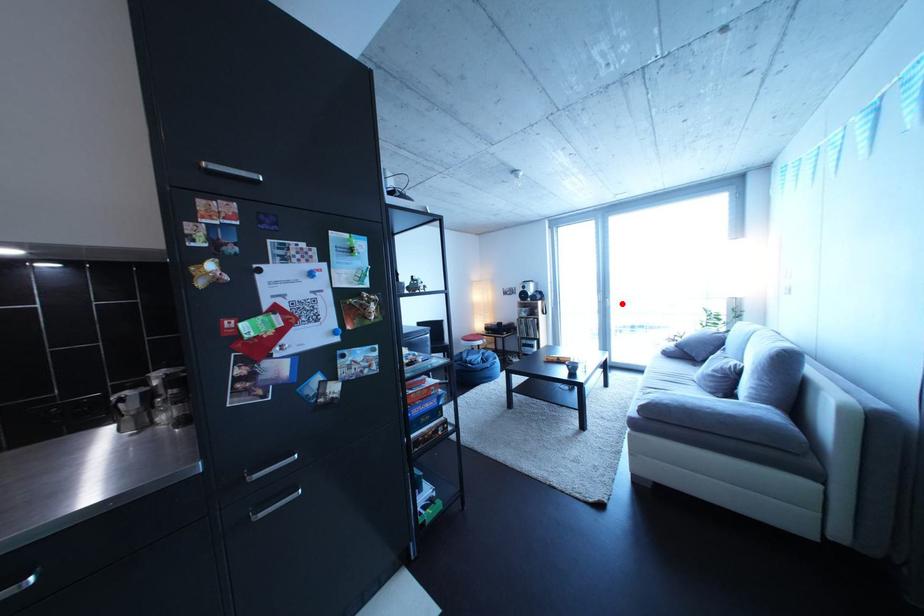
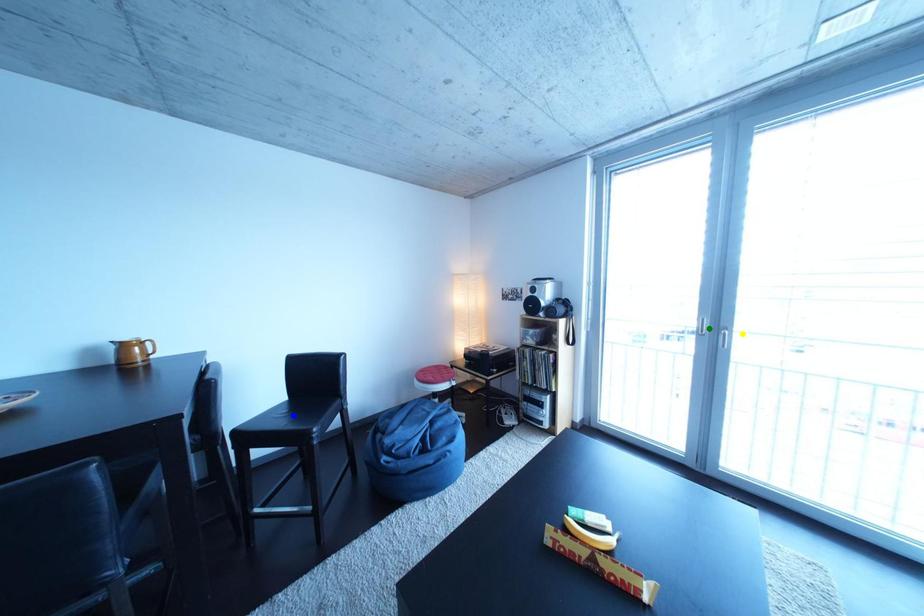
Question: I am providing you with two images of the same scene from different viewpoints. A red point is marked on the first image. You are given multiple points on the second image. Which point in image 2 represents the same 3d spot as the red point in image 1?

Choices:
 (A) yellow point
 (B) green point
 (C) blue point

Answer: (A)